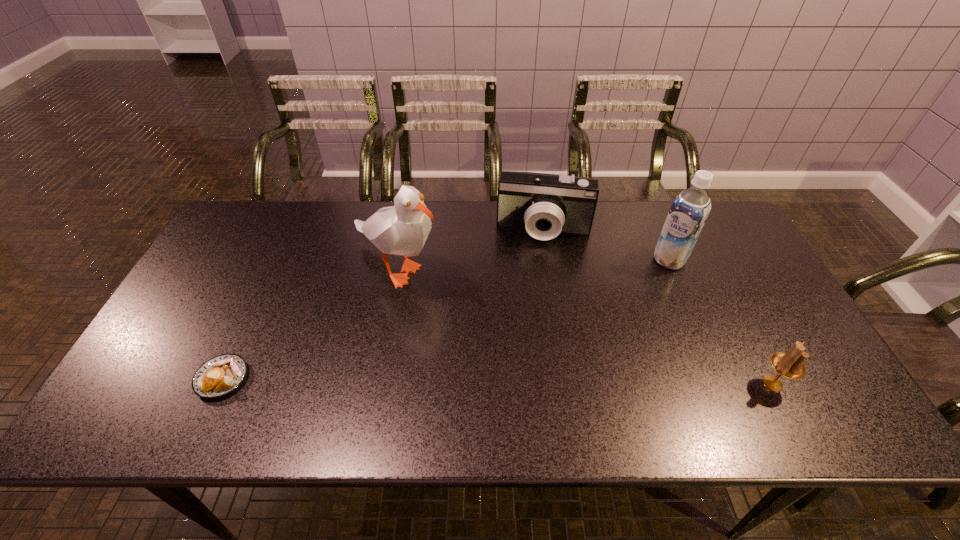
Locate an element on the screen. This screenshot has width=960, height=540. free region located on the lens of the camcorder is located at coordinates (534, 294).

At what (x,y) coordinates should I click in order to perform the action: click on free space located on the label of the fourth object from left to right. Please return your answer as a coordinate pair (x, y). Image resolution: width=960 pixels, height=540 pixels. Looking at the image, I should click on click(589, 346).

Image resolution: width=960 pixels, height=540 pixels. What are the coordinates of `vacant space located 0.190m on the label of the fourth object from left to right` in the screenshot? It's located at (628, 305).

The height and width of the screenshot is (540, 960). What are the coordinates of `vacant region located 0.240m on the label of the fourth object from left to right` in the screenshot? It's located at (618, 315).

This screenshot has height=540, width=960. What are the coordinates of `free space located at the beak of the second object from left to right` in the screenshot? It's located at (420, 347).

Where is `free space located at the beak of the second object from left to right`? This screenshot has width=960, height=540. free space located at the beak of the second object from left to right is located at coordinates (425, 363).

What are the coordinates of `free space located 0.080m at the beak of the second object from left to right` in the screenshot? It's located at (414, 323).

The image size is (960, 540). In order to click on camcorder that is positioned at the far edge in this screenshot , I will do `click(545, 205)`.

Find the location of a particular element. The width and height of the screenshot is (960, 540). soya milk present at the far edge is located at coordinates (688, 213).

Where is `gull present at the far edge`? This screenshot has height=540, width=960. gull present at the far edge is located at coordinates (402, 229).